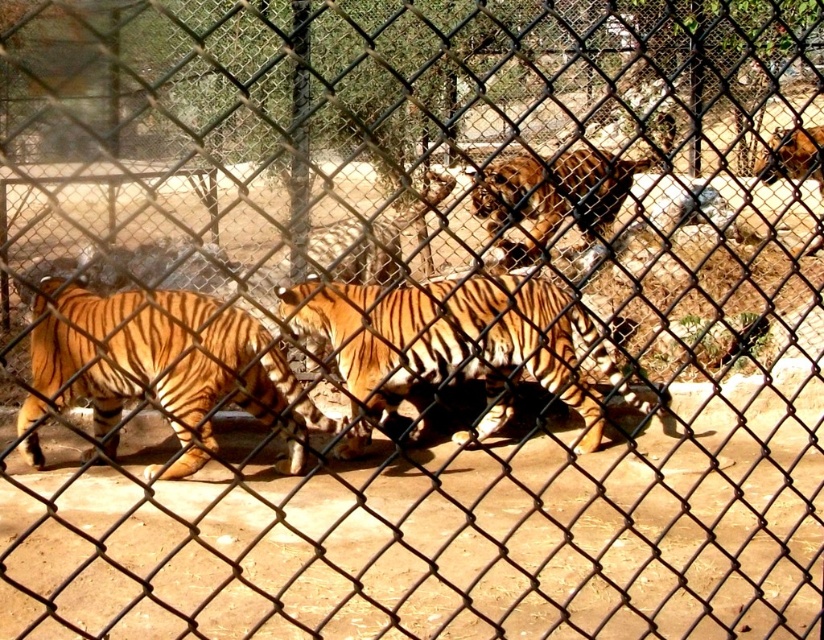
Question: Which point is closer to the camera taking this photo?

Choices:
 (A) (350, 406)
 (B) (164, 355)

Answer: (B)

Question: Which object is farther from the camera taking this photo?

Choices:
 (A) orange striped tiger at left
 (B) orange striped tiger at center

Answer: (B)

Question: Does orange striped tiger at center have a larger size compared to orange striped tiger at left?

Choices:
 (A) yes
 (B) no

Answer: (A)

Question: Is orange striped tiger at center positioned in front of orange striped tiger at left?

Choices:
 (A) yes
 (B) no

Answer: (B)

Question: Which of the following is the farthest from the observer?

Choices:
 (A) orange striped tiger at left
 (B) orange striped tiger at center

Answer: (B)

Question: Is the position of orange striped tiger at center more distant than that of orange striped tiger at left?

Choices:
 (A) no
 (B) yes

Answer: (B)